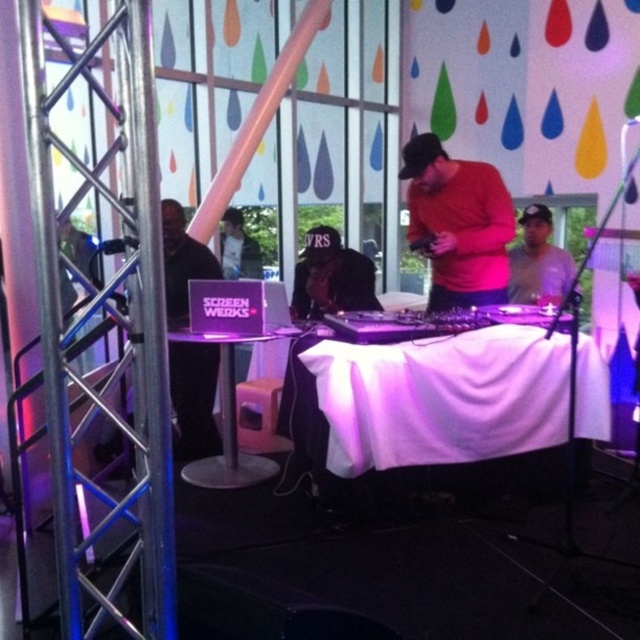
You are at the event and want to move from the DJ booth to the scaffolding structure. The DJ booth is located at point [237,474] and the scaffolding structure is at point [257,244]. Since you can only move forward, which point should you head towards to reach the scaffolding structure?

Point [257,244] is behind point [237,474], so you should head towards point [257,244] to reach the scaffolding structure.